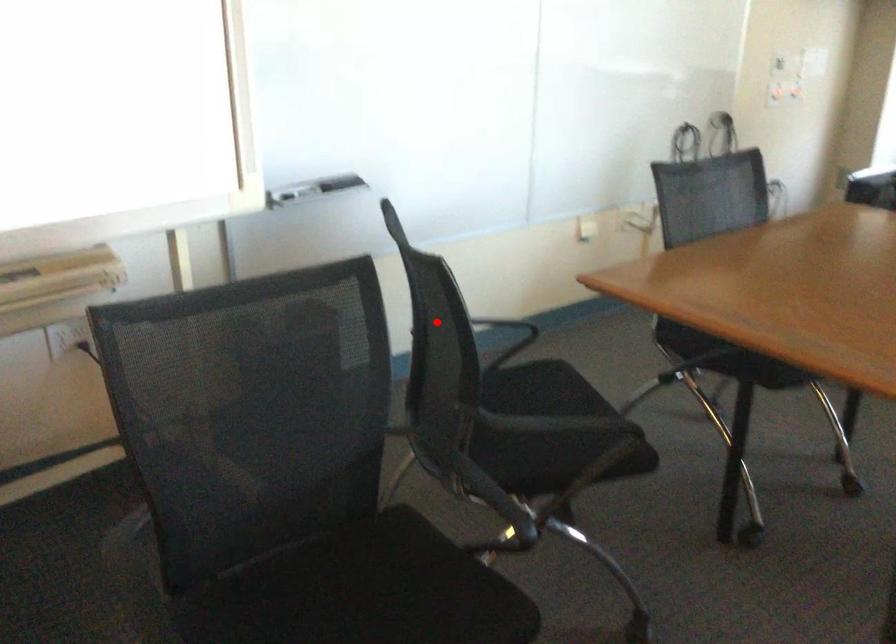
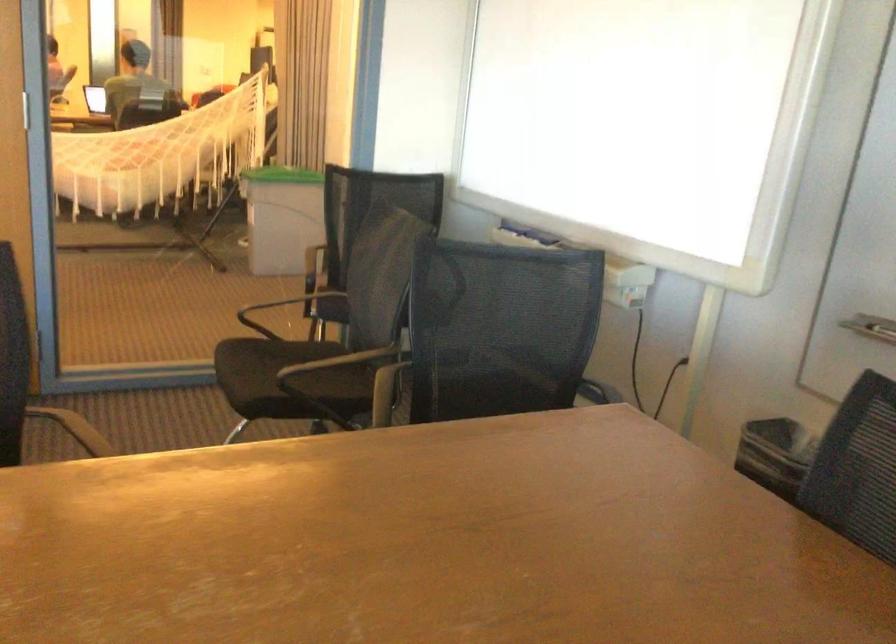
Locate, in the second image, the point that corresponds to the highlighted location in the first image.

(501, 328)